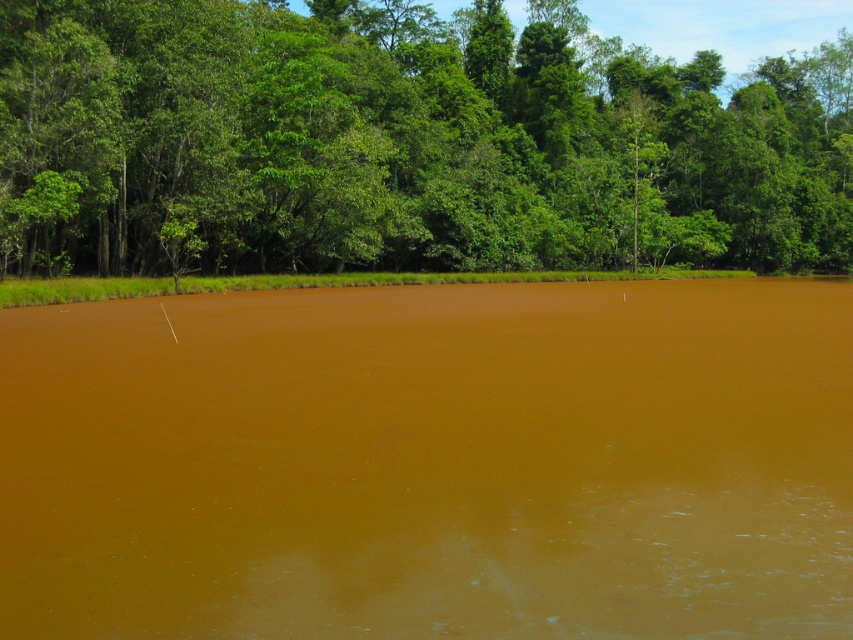
You are standing at the edge of the brown matte lake at center and looking towards the green leafy tree at upper center. Which object appears taller in the scene?

The green leafy tree at upper center appears taller than the brown matte lake at center in the scene.

You are a bird flying over the brown matte lake at center and the green leafy tree at upper center. Which object is located above the other?

The green leafy tree at upper center is located above the brown matte lake at center.

You are standing at the edge of the brown matte lake at center and looking towards the green leafy tree at upper center. Which object is closer to you?

The brown matte lake at center is closer to you since it is positioned in front of the green leafy tree at upper center.